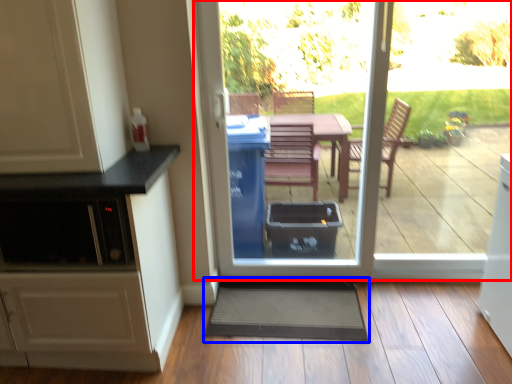
Question: Which of the following is the farthest to the observer, door (highlighted by a red box) or doormat (highlighted by a blue box)?

Choices:
 (A) door
 (B) doormat

Answer: (B)